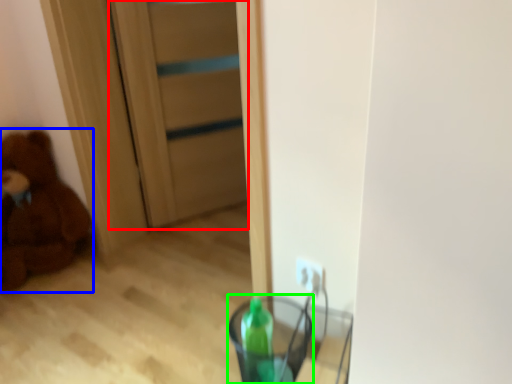
Question: Based on their relative distances, which object is nearer to door (highlighted by a red box)? Choose from teddy bear (highlighted by a blue box) and glass vase (highlighted by a green box).

Choices:
 (A) teddy bear
 (B) glass vase

Answer: (A)